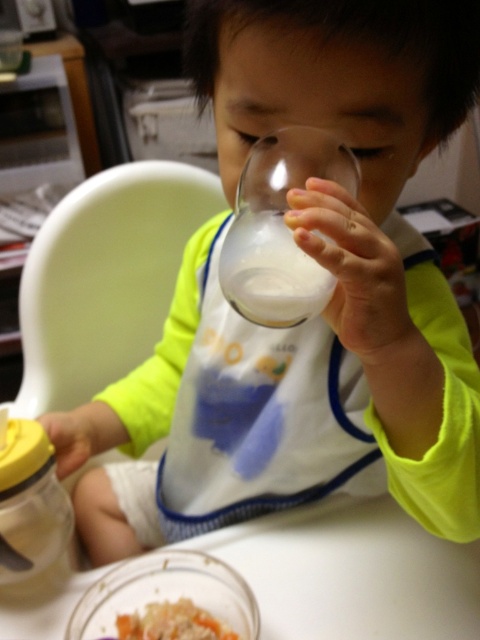
Question: Which of the following is the farthest from the observer?

Choices:
 (A) (335, 556)
 (B) (64, 538)
 (C) (202, 609)

Answer: (A)

Question: Does yellow matte bottle at lower left come in front of smooth brown rice at lower center?

Choices:
 (A) no
 (B) yes

Answer: (A)

Question: Is white plastic table at lower center smaller than yellow matte bottle at lower left?

Choices:
 (A) no
 (B) yes

Answer: (A)

Question: Which point is farther from the camera taking this photo?

Choices:
 (A) (51, 477)
 (B) (363, 628)

Answer: (A)

Question: Which point is closer to the camera taking this photo?

Choices:
 (A) (48, 509)
 (B) (131, 620)
 (C) (479, 618)

Answer: (C)

Question: From the image, what is the correct spatial relationship of white plastic table at lower center in relation to smooth brown rice at lower center?

Choices:
 (A) below
 (B) above

Answer: (B)